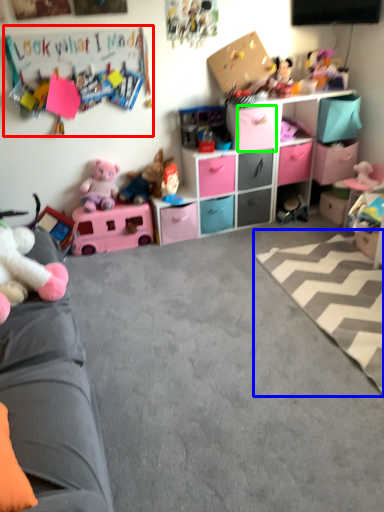
Question: Based on their relative distances, which object is farther from bulletin board (highlighted by a red box)? Choose from plain (highlighted by a blue box) and drawer (highlighted by a green box).

Choices:
 (A) plain
 (B) drawer

Answer: (A)